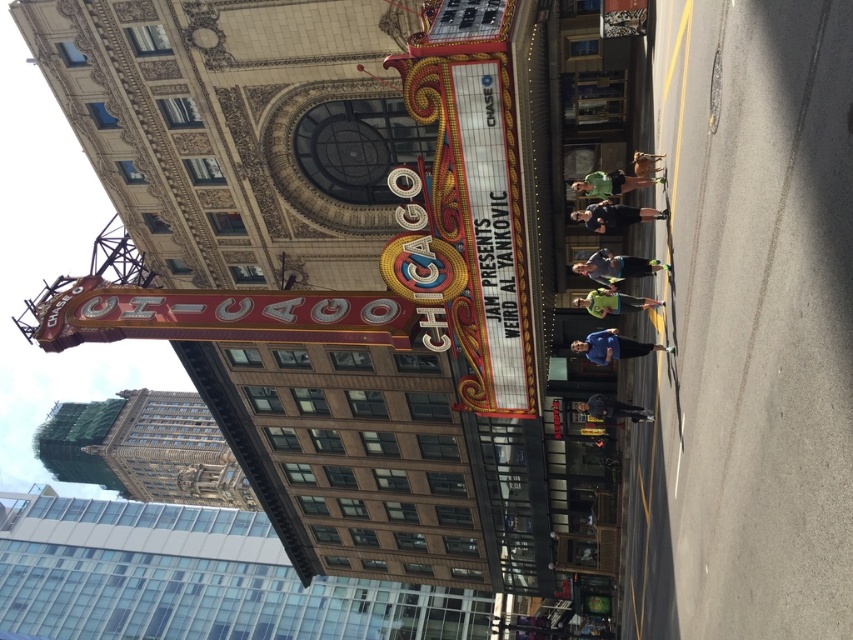
Question: Is matte black jacket at center above green fabric shirt at center?

Choices:
 (A) yes
 (B) no

Answer: (B)

Question: Among these objects, which one is nearest to the camera?

Choices:
 (A) black fabric pants at center
 (B) metallic gold statue at center
 (C) dark gray pants at center
 (D) green matte shirt at center

Answer: (A)

Question: Does blue fabric shirt at center have a greater width compared to green fabric shirt at center?

Choices:
 (A) yes
 (B) no

Answer: (A)

Question: Among these points, which one is farthest from the camera?

Choices:
 (A) (616, 216)
 (B) (598, 259)

Answer: (B)

Question: Which point is closer to the camera?

Choices:
 (A) matte black jacket at center
 (B) metallic gold statue at center
 (C) green fabric shirt at center

Answer: (A)

Question: Is blue fabric shirt at center smaller than black fabric pants at center?

Choices:
 (A) yes
 (B) no

Answer: (A)